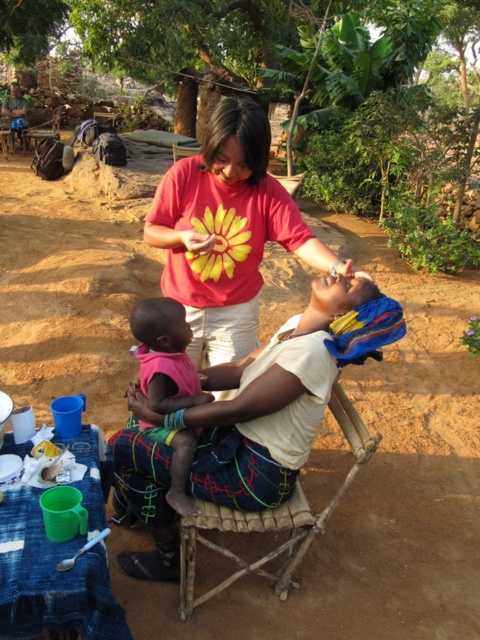
Is floral t-shirt at center to the right of pink fabric baby at center from the viewer's perspective?

Yes, floral t-shirt at center is to the right of pink fabric baby at center.

Is floral t-shirt at center positioned before pink fabric baby at center?

Yes, it is in front of pink fabric baby at center.

Locate an element on the screen. The height and width of the screenshot is (640, 480). floral t-shirt at center is located at coordinates (227, 230).

Locate an element on the screen. This screenshot has height=640, width=480. floral t-shirt at center is located at coordinates click(227, 230).

Does bamboo chair at center appear on the right side of pink fabric baby at center?

Correct, you'll find bamboo chair at center to the right of pink fabric baby at center.

Between bamboo chair at center and pink fabric baby at center, which one is positioned lower?

bamboo chair at center is below.

Does point (201, 509) come farther from viewer compared to point (179, 372)?

No, (201, 509) is closer to viewer.

Find the location of a particular element. bamboo chair at center is located at coordinates (271, 518).

Based on the photo, who is taller, floral t-shirt at center or bamboo chair at center?

With more height is floral t-shirt at center.

I want to click on floral t-shirt at center, so click(x=227, y=230).

Is point (349, 268) behind point (289, 500)?

That is False.

Locate an element on the screen. The width and height of the screenshot is (480, 640). floral t-shirt at center is located at coordinates (227, 230).